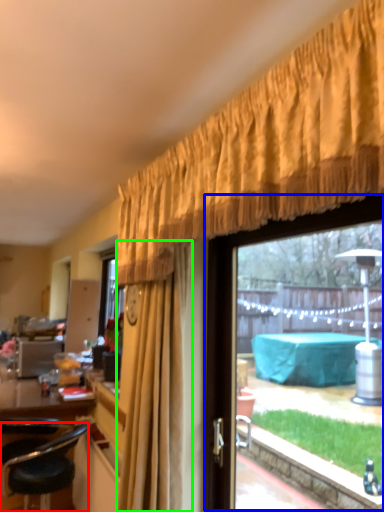
Question: Which is farther away from chair (highlighted by a red box)? window (highlighted by a blue box) or curtain (highlighted by a green box)?

Choices:
 (A) window
 (B) curtain

Answer: (A)